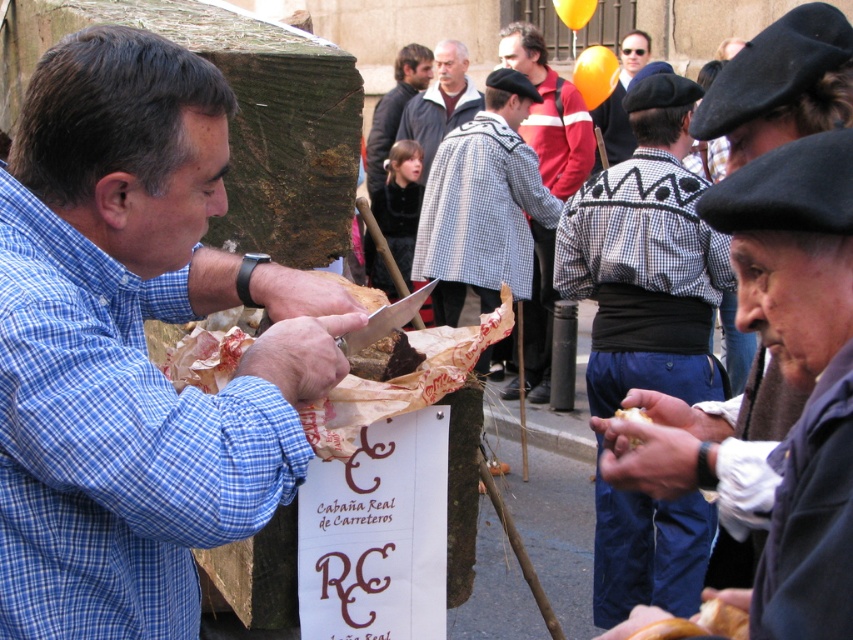
You are a tailor observing the checkered wool coat at center and the gray wool coat at center. Which coat would require more fabric for the sleeves if both have the same sleeve length?

The checkered wool coat at center is much taller than the gray wool coat at center, so it would require more fabric for the sleeves if both have the same sleeve length.

You are standing at the origin point of the image. Which direction should you move to reach the checkered wool coat at center?

The checkered wool coat at center is located at coordinates point (483, 204), so you should move towards the right and upwards from the origin point to reach it.

You are a tailor observing the scene and need to determine if the checkered wool coat at center can be placed on a hanger designed for the golden brown bread at lower right. Based on their widths, will the coat fit on the hanger?

The checkered wool coat at center is wider than the golden brown bread at lower right, so it will not fit on the hanger designed for the bread.